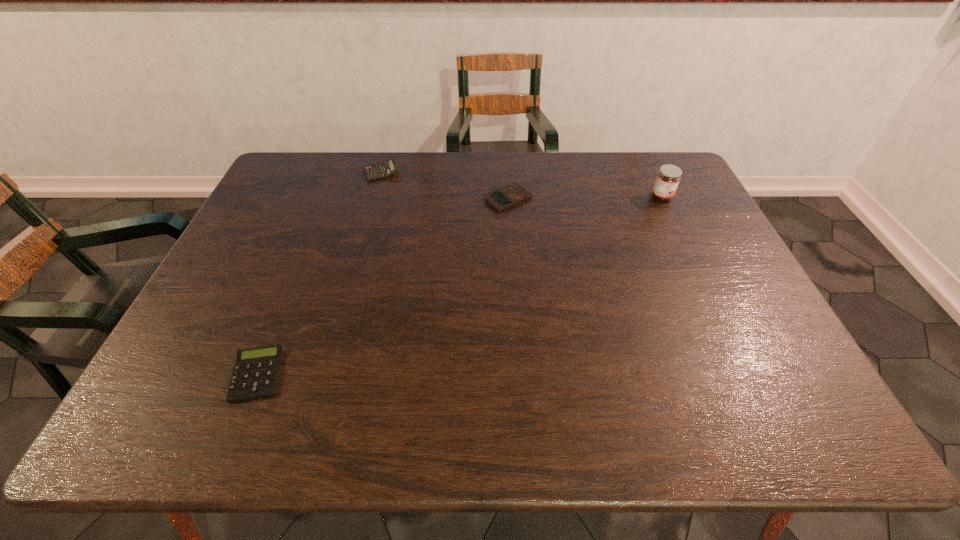
At what (x,y) coordinates should I click in order to perform the action: click on free space between the nearest calculator and the second farthest calculator. Please return your answer as a coordinate pair (x, y). Looking at the image, I should click on (383, 287).

The width and height of the screenshot is (960, 540). I want to click on empty space that is in between the tallest calculator and the rightmost calculator, so click(x=444, y=185).

Where is `object that is the second closest to the rightmost object`? object that is the second closest to the rightmost object is located at coordinates (384, 170).

Locate which object is the second closest to the tallest calculator. Please provide its 2D coordinates. Your answer should be formatted as a tuple, i.e. [(x, y)], where the tuple contains the x and y coordinates of a point satisfying the conditions above.

[(256, 372)]

Identify which calculator is the third closest to the tallest object. Please provide its 2D coordinates. Your answer should be formatted as a tuple, i.e. [(x, y)], where the tuple contains the x and y coordinates of a point satisfying the conditions above.

[(256, 372)]

Where is `the second closest calculator to the second calculator from left to right`? This screenshot has width=960, height=540. the second closest calculator to the second calculator from left to right is located at coordinates (256, 372).